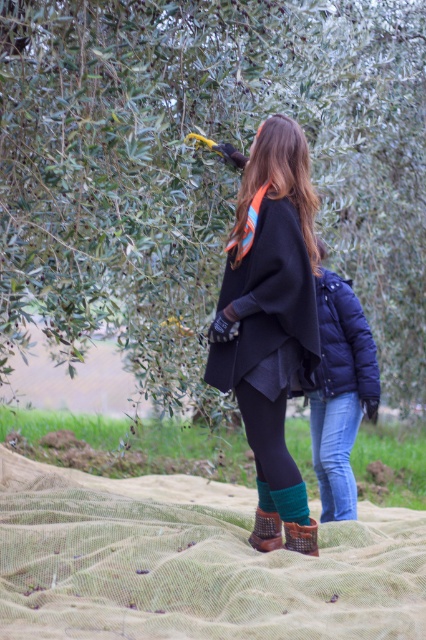
Between point (267, 163) and point (368, 392), which one is positioned behind?

Positioned behind is point (368, 392).

Who is more distant from viewer, (279, 234) or (340, 285)?

Positioned behind is point (340, 285).

Find the location of a particular element. matte black coat at center is located at coordinates (270, 307).

Between beige mesh blanket at lower center and matte black coat at center, which one is positioned lower?

beige mesh blanket at lower center is below.

This screenshot has width=426, height=640. What do you see at coordinates (192, 563) in the screenshot?
I see `beige mesh blanket at lower center` at bounding box center [192, 563].

Find the location of `beige mesh blanket at lower center`. beige mesh blanket at lower center is located at coordinates (192, 563).

Can you confirm if dark blue puffer jacket at center is wider than brown suede boot at lower center?

Yes.

Between dark blue puffer jacket at center and brown suede boot at lower center, which one appears on the left side from the viewer's perspective?

Positioned to the left is brown suede boot at lower center.

Identify the location of dark blue puffer jacket at center. (344, 342).